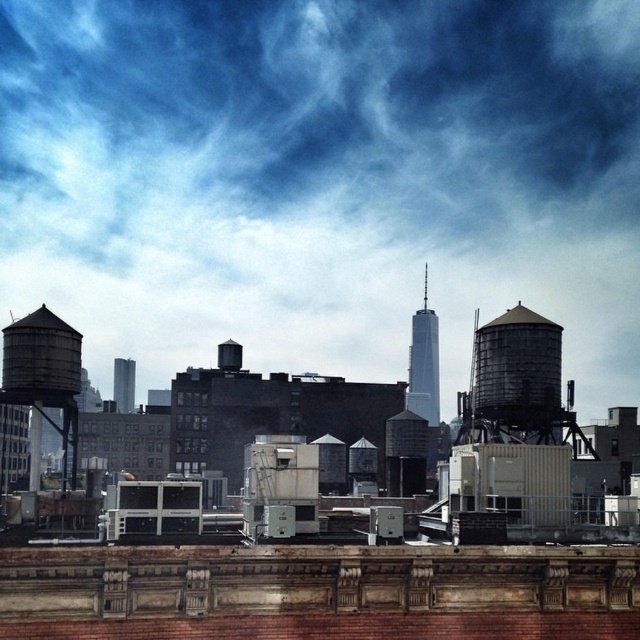
Can you confirm if cloudy sky at upper center is taller than metallic silver water tower at center?

Yes, cloudy sky at upper center is taller than metallic silver water tower at center.

You are a GUI agent. You are given a task and a screenshot of the screen. Output one action in this format:
    pyautogui.click(x=<x>, y=<y>)
    Task: Click on the cloudy sky at upper center
    
    Given the screenshot: What is the action you would take?
    pyautogui.click(x=323, y=179)

At what (x,y) coordinates should I click in order to perform the action: click on cloudy sky at upper center. Please return your answer as a coordinate pair (x, y). The width and height of the screenshot is (640, 640). Looking at the image, I should click on (323, 179).

From the picture: Is rustic metal water tower at right smaller than metallic silver water tower at center?

Yes, rustic metal water tower at right is smaller than metallic silver water tower at center.

The height and width of the screenshot is (640, 640). In order to click on rustic metal water tower at right in this screenshot , I will do `click(516, 376)`.

At what (x,y) coordinates should I click in order to perform the action: click on rustic metal water tower at right. Please return your answer as a coordinate pair (x, y). The width and height of the screenshot is (640, 640). Looking at the image, I should click on (516, 376).

Is cloudy sky at upper center further to the viewer compared to rustic metal water tower at right?

Yes, it is.

Is cloudy sky at upper center to the right of rustic metal water tower at right from the viewer's perspective?

No, cloudy sky at upper center is not to the right of rustic metal water tower at right.

Between point (355, 339) and point (509, 348), which one is positioned in front?

Positioned in front is point (509, 348).

The width and height of the screenshot is (640, 640). Find the location of `cloudy sky at upper center`. cloudy sky at upper center is located at coordinates (323, 179).